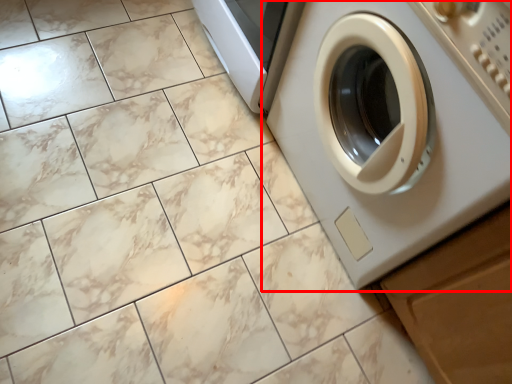
Question: From the image's perspective, where is washing machine (annotated by the red box) located relative to drawer?

Choices:
 (A) below
 (B) above

Answer: (B)